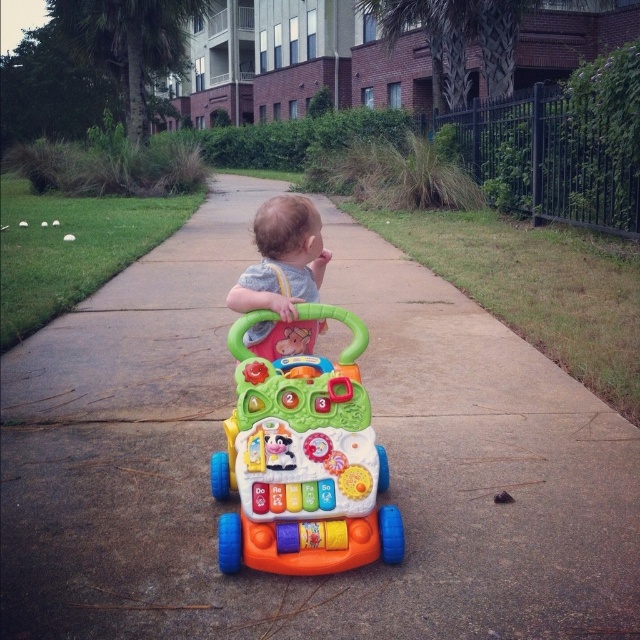
You are a parent trying to ensure your child can safely use the multicolored plastic walker at center. Considering the height difference between the walker and the gray fabric baby at center, is the walker too tall for the baby to comfortably hold the handlebars?

The multicolored plastic walker at center is taller than the gray fabric baby at center, so it may be too tall for the baby to comfortably hold the handlebars.

You are a parent trying to push your child through a narrow doorway that is only 1 meter wide. The orange plastic walker at center and the gray fabric baby at center are both in the way. Which object should you move first to ensure the doorway is wide enough?

The orange plastic walker at center is thinner than the gray fabric baby at center, so you should move the gray fabric baby at center first to ensure the doorway is wide enough.

You are a parent trying to move the orange plastic walker at center and the multicolored plastic walker at center. Based on their positions, which one would you need to move first to access the other?

The orange plastic walker at center is positioned under the multicolored plastic walker at center, so you should move the orange plastic walker at center first to access the multicolored plastic walker at center.